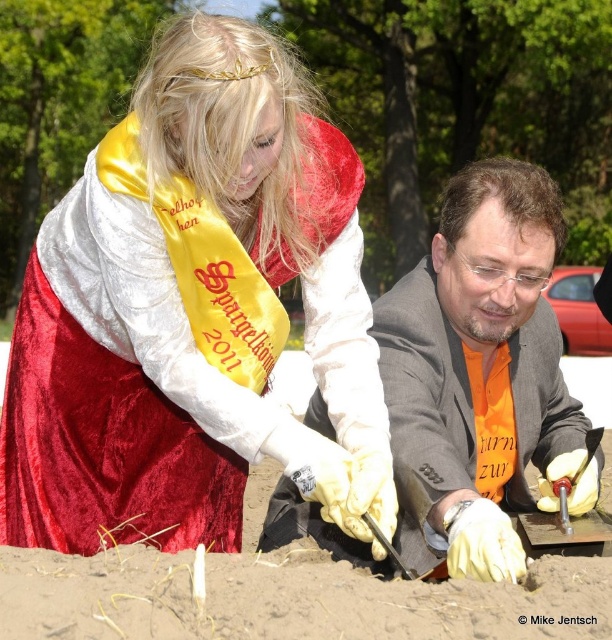
Is orange fabric suit at center wider than brown sandy soil at lower center?

No, orange fabric suit at center is not wider than brown sandy soil at lower center.

Can you confirm if orange fabric suit at center is bigger than brown sandy soil at lower center?

Yes, orange fabric suit at center is bigger than brown sandy soil at lower center.

Which is behind, point (477, 292) or point (61, 582)?

The point (477, 292) is behind.

The height and width of the screenshot is (640, 612). In order to click on orange fabric suit at center in this screenshot , I will do `click(477, 374)`.

Is point (190, 472) positioned before point (86, 628)?

No, it is behind (86, 628).

Does velvet red dress at center have a greater width compared to brown sandy soil at lower center?

No.

Which is behind, point (165, 397) or point (39, 561)?

Positioned behind is point (165, 397).

At what (x,y) coordinates should I click in order to perform the action: click on velvet red dress at center. Please return your answer as a coordinate pair (x, y). The height and width of the screenshot is (640, 612). Looking at the image, I should click on (195, 314).

Between velvet red dress at center and orange fabric suit at center, which one appears on the right side from the viewer's perspective?

orange fabric suit at center

Does velvet red dress at center have a larger size compared to orange fabric suit at center?

Actually, velvet red dress at center might be smaller than orange fabric suit at center.

Where is `velvet red dress at center`? This screenshot has width=612, height=640. velvet red dress at center is located at coordinates (195, 314).